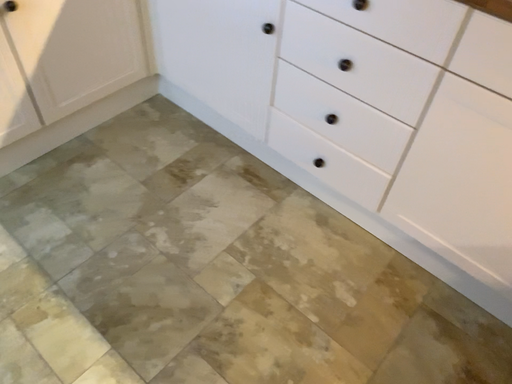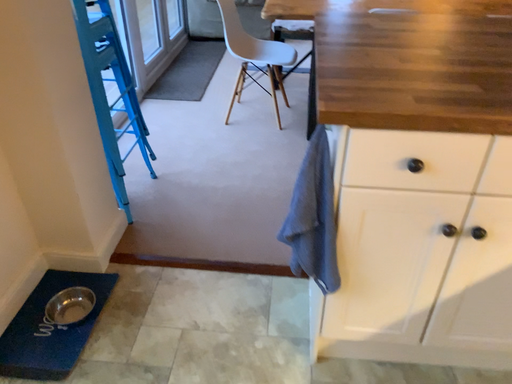
Question: Which way did the camera rotate in the video?

Choices:
 (A) rotated left
 (B) rotated right

Answer: (A)